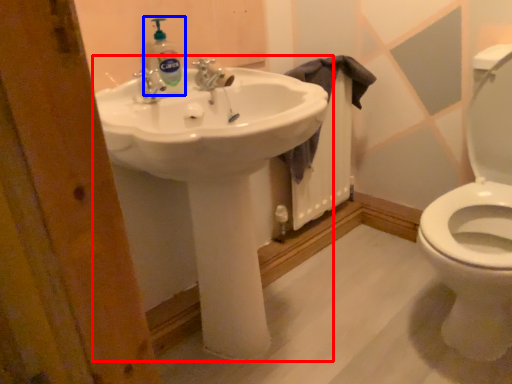
Question: Which object is closer to the camera taking this photo, sink (highlighted by a red box) or cleaning product (highlighted by a blue box)?

Choices:
 (A) sink
 (B) cleaning product

Answer: (A)